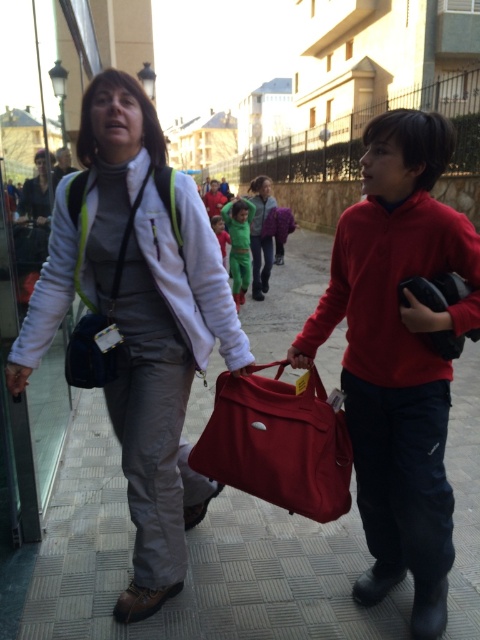
Question: Does matte black bag at right appear on the right side of matte green jacket at center?

Choices:
 (A) no
 (B) yes

Answer: (B)

Question: In this image, where is matte white jacket at center located relative to matte red bag at center?

Choices:
 (A) below
 (B) above

Answer: (B)

Question: Estimate the real-world distances between objects in this image. Which object is farther from the matte white jacket at center?

Choices:
 (A) matte red bag at center
 (B) matte concrete pavement at center
 (C) matte black bag at right
 (D) green fleece jumpsuit at center

Answer: (D)

Question: Does matte green jacket at center have a lesser width compared to green fleece jumpsuit at center?

Choices:
 (A) no
 (B) yes

Answer: (B)

Question: Which object appears farthest from the camera in this image?

Choices:
 (A) matte green jacket at center
 (B) matte white jacket at center

Answer: (A)

Question: Which point is farther to the camera?

Choices:
 (A) (71, 257)
 (B) (382, 168)

Answer: (A)